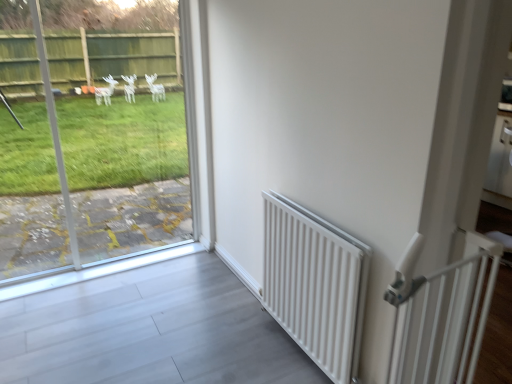
Question: Is white matte radiator at right further to camera compared to transparent glass window at left?

Choices:
 (A) yes
 (B) no

Answer: (B)

Question: Can you confirm if white matte radiator at right is smaller than transparent glass window at left?

Choices:
 (A) yes
 (B) no

Answer: (A)

Question: Is white matte radiator at right not within transparent glass window at left?

Choices:
 (A) yes
 (B) no

Answer: (A)

Question: From a real-world perspective, is white matte radiator at right below transparent glass window at left?

Choices:
 (A) no
 (B) yes

Answer: (B)

Question: Does white matte radiator at right touch transparent glass window at left?

Choices:
 (A) no
 (B) yes

Answer: (A)

Question: From a real-world perspective, is white plastic gate at right positioned above or below white matte radiator at right?

Choices:
 (A) above
 (B) below

Answer: (A)

Question: Is white plastic gate at right bigger or smaller than white matte radiator at right?

Choices:
 (A) big
 (B) small

Answer: (B)

Question: Relative to white matte radiator at right, is white plastic gate at right in front or behind?

Choices:
 (A) front
 (B) behind

Answer: (A)

Question: In the image, is white plastic gate at right on the left side or the right side of white matte radiator at right?

Choices:
 (A) left
 (B) right

Answer: (B)

Question: Considering the positions of point (315, 269) and point (488, 248), is point (315, 269) closer or farther from the camera than point (488, 248)?

Choices:
 (A) farther
 (B) closer

Answer: (A)

Question: From their relative heights in the image, would you say white matte radiator at right is taller or shorter than white plastic gate at right?

Choices:
 (A) tall
 (B) short

Answer: (B)

Question: From a real-world perspective, relative to white plastic gate at right, is white matte radiator at right vertically above or below?

Choices:
 (A) below
 (B) above

Answer: (A)

Question: Choose the correct answer: Is white matte radiator at right inside white plastic gate at right or outside it?

Choices:
 (A) outside
 (B) inside

Answer: (A)

Question: Considering the positions of point (143, 64) and point (318, 233), is point (143, 64) closer or farther from the camera than point (318, 233)?

Choices:
 (A) farther
 (B) closer

Answer: (A)

Question: From their relative heights in the image, would you say transparent glass window at left is taller or shorter than white matte radiator at right?

Choices:
 (A) short
 (B) tall

Answer: (B)